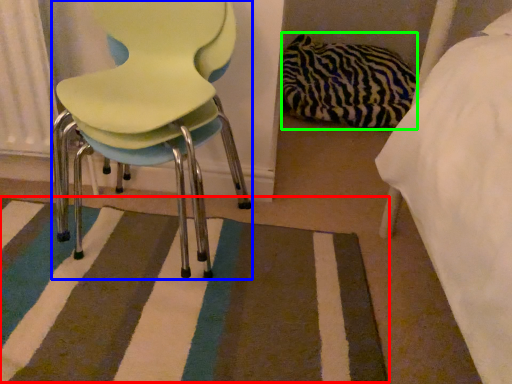
Question: Considering the real-world distances, which object is closest to mat (highlighted by a red box)? chair (highlighted by a blue box) or material (highlighted by a green box).

Choices:
 (A) chair
 (B) material

Answer: (A)